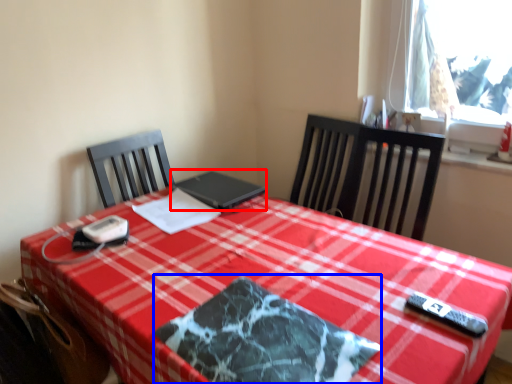
Question: Which object is closer to the camera taking this photo, laptop (highlighted by a red box) or place mat (highlighted by a blue box)?

Choices:
 (A) laptop
 (B) place mat

Answer: (B)